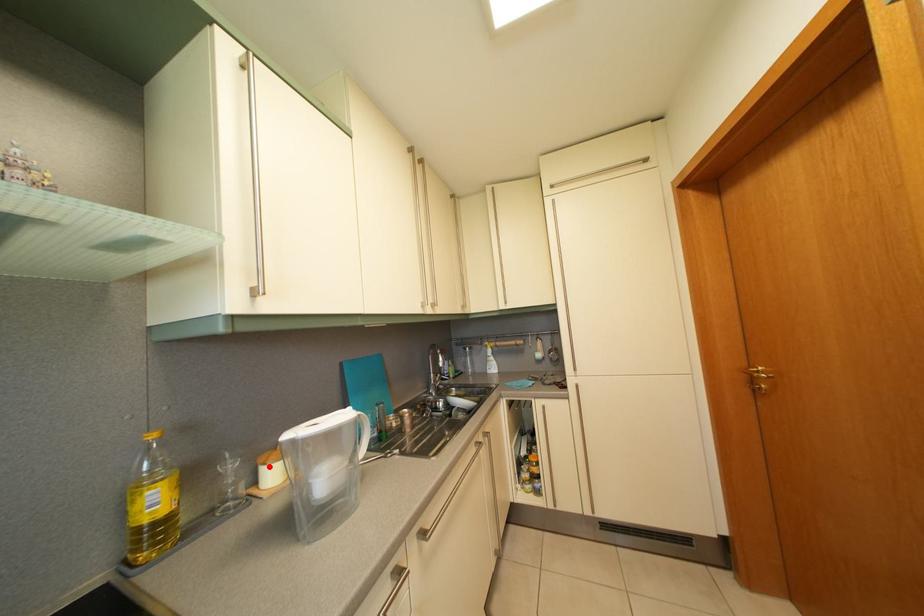
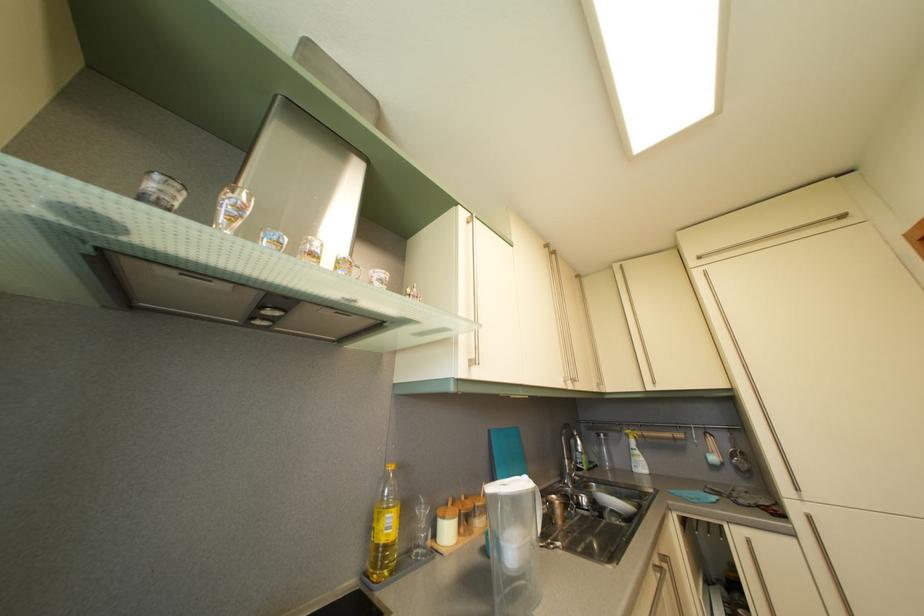
Question: A red point is marked in image1. In image2, is the corresponding 3D point closer to the camera or farther? Reply with the corresponding letter.

Choices:
 (A) The corresponding 3D point is closer.
 (B) The corresponding 3D point is farther.

Answer: (A)